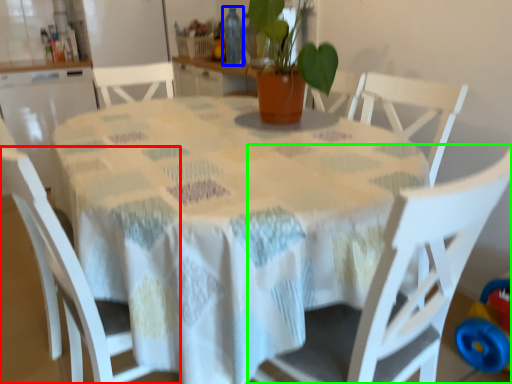
Question: Estimate the real-world distances between objects in this image. Which object is farther from chair (highlighted by a red box), bottle (highlighted by a blue box) or chair (highlighted by a green box)?

Choices:
 (A) bottle
 (B) chair

Answer: (A)